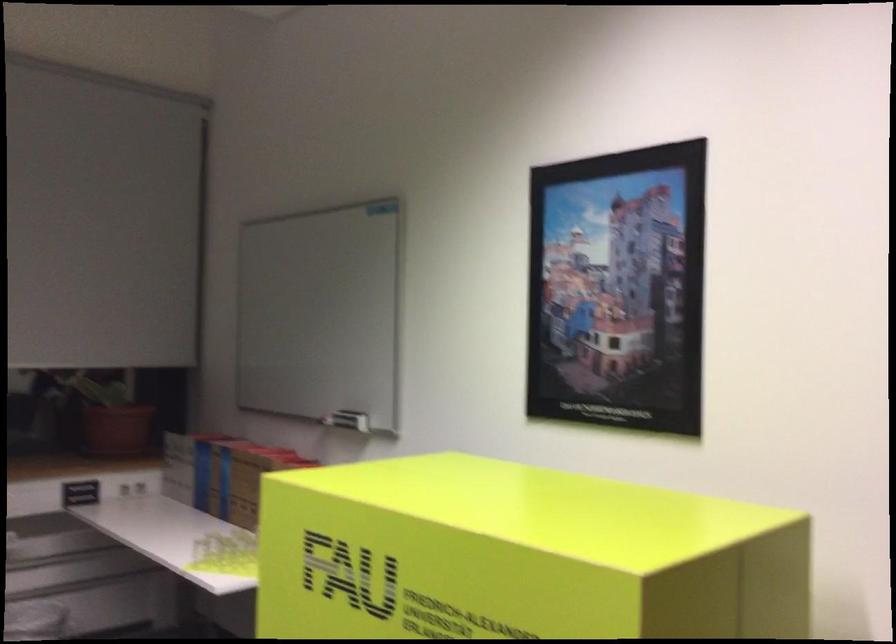
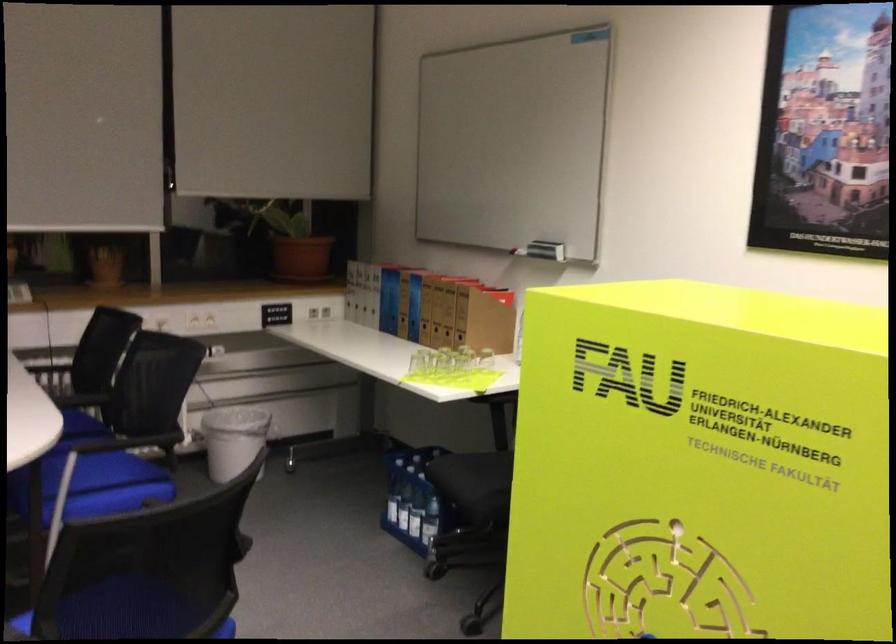
Locate, in the second image, the point that corresponds to point 109,413 in the first image.

(294, 243)